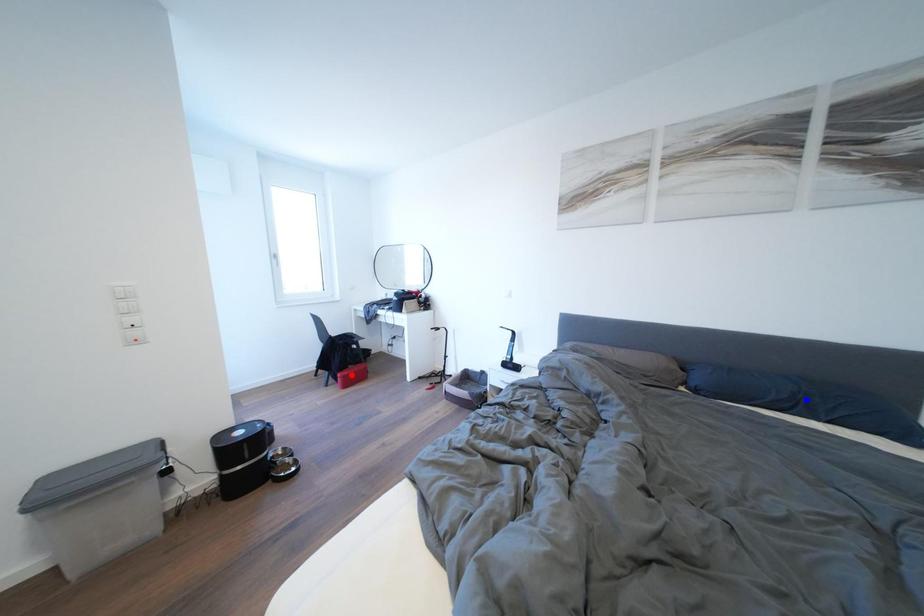
Question: Two points are marked on the image. Which point is closer to the camera?

Choices:
 (A) Blue point is closer.
 (B) Red point is closer.

Answer: (A)